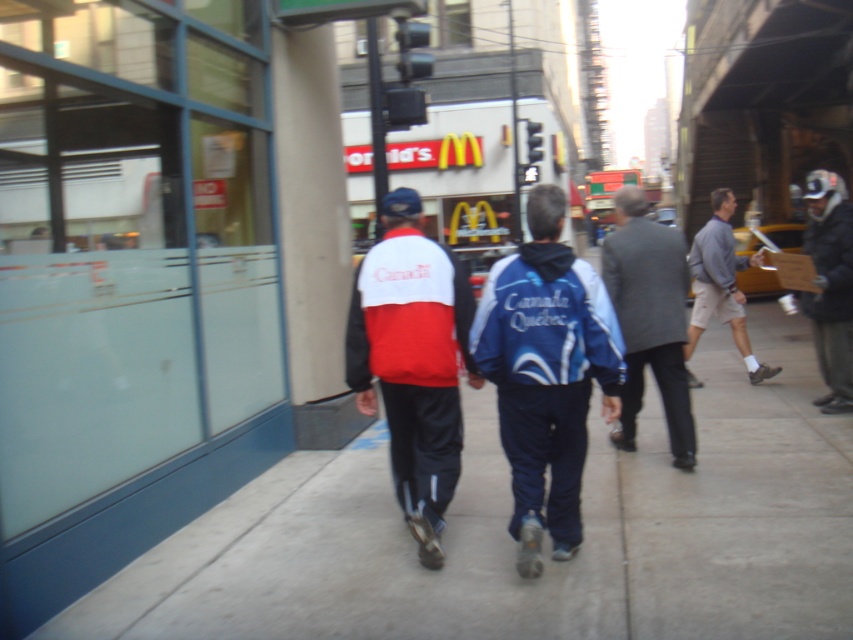
You are a photographer trying to capture a shot of both the matte red and white jacket at center and the dark gray jacket at right in your frame. Based on their positions, which jacket should you focus on first to ensure both are in the shot?

The matte red and white jacket at center is located below the dark gray jacket at right. To capture both in the frame, focus on the dark gray jacket at right first as it is higher up, allowing the lower positioned matte red and white jacket at center to naturally fall into the shot below.

You are a photographer trying to capture both the blue fabric jacket at center and the gray fabric jacket at right in a single frame. Based on their heights, which jacket will appear taller in the photo?

The gray fabric jacket at right will appear taller in the photo because it is taller than the blue fabric jacket at center.